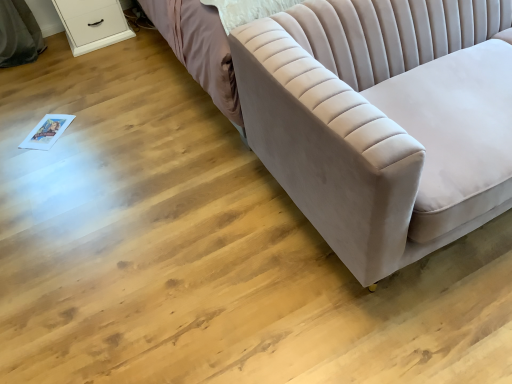
Question: Choose the correct answer: Is velvet beige couch at right inside white glossy dresser at upper left or outside it?

Choices:
 (A) inside
 (B) outside

Answer: (B)

Question: Considering the positions of point click(x=267, y=137) and point click(x=80, y=11), is point click(x=267, y=137) closer or farther from the camera than point click(x=80, y=11)?

Choices:
 (A) closer
 (B) farther

Answer: (A)

Question: From a real-world perspective, is velvet beige couch at right physically located above or below white glossy dresser at upper left?

Choices:
 (A) above
 (B) below

Answer: (A)

Question: Considering their positions, is white glossy dresser at upper left located in front of or behind velvet beige couch at right?

Choices:
 (A) front
 (B) behind

Answer: (B)

Question: Is white glossy dresser at upper left taller or shorter than velvet beige couch at right?

Choices:
 (A) short
 (B) tall

Answer: (A)

Question: Does point (74, 6) appear closer or farther from the camera than point (352, 84)?

Choices:
 (A) farther
 (B) closer

Answer: (A)

Question: Considering the positions of white glossy dresser at upper left and velvet beige couch at right in the image, is white glossy dresser at upper left bigger or smaller than velvet beige couch at right?

Choices:
 (A) small
 (B) big

Answer: (A)